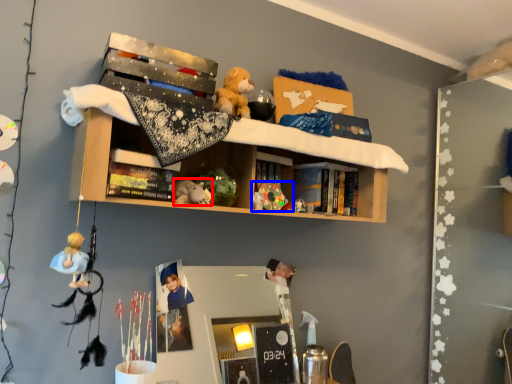
Question: Which point is further to the camera, toy (highlighted by a red box) or toy (highlighted by a blue box)?

Choices:
 (A) toy
 (B) toy

Answer: (B)